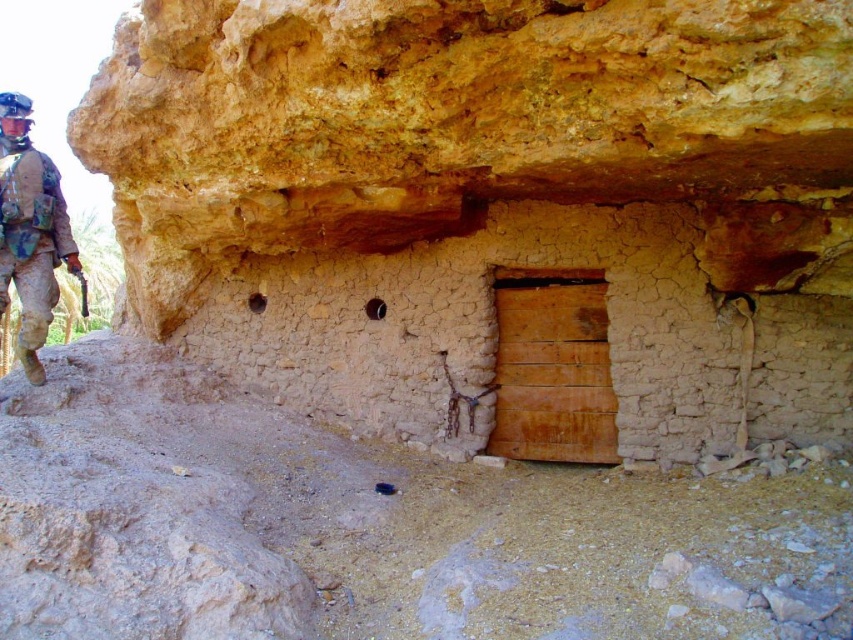
Question: Which of the following is the farthest from the observer?

Choices:
 (A) camouflage fabric uniform at left
 (B) cracked beige wall at center

Answer: (A)

Question: Among these objects, which one is farthest from the camera?

Choices:
 (A) cracked beige wall at center
 (B) camouflage fabric uniform at left

Answer: (B)

Question: Considering the relative positions of cracked beige wall at center and camouflage fabric uniform at left in the image provided, where is cracked beige wall at center located with respect to camouflage fabric uniform at left?

Choices:
 (A) above
 (B) below

Answer: (A)

Question: Does cracked beige wall at center have a lesser width compared to camouflage fabric uniform at left?

Choices:
 (A) yes
 (B) no

Answer: (B)

Question: Is cracked beige wall at center above camouflage fabric uniform at left?

Choices:
 (A) yes
 (B) no

Answer: (A)